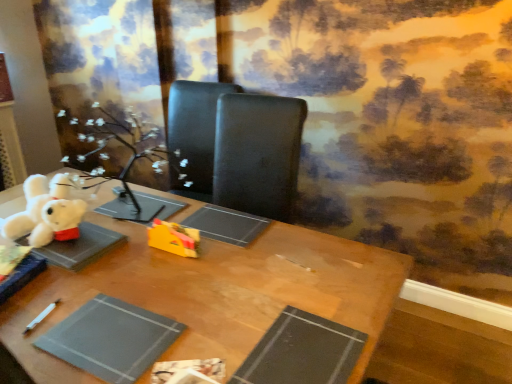
Image resolution: width=512 pixels, height=384 pixels. In order to click on free space between gray matte paper at lower left, which appears as the first paperback book when viewed from the left, and black matte paperback book at lower center, marked as the second paperback book in a left-to-right arrangement in this screenshot , I will do `click(195, 319)`.